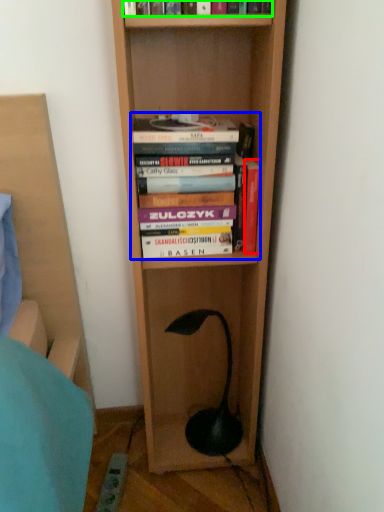
Question: Which is farther away from book (highlighted by a red box)? book (highlighted by a blue box) or book (highlighted by a green box)?

Choices:
 (A) book
 (B) book

Answer: (B)